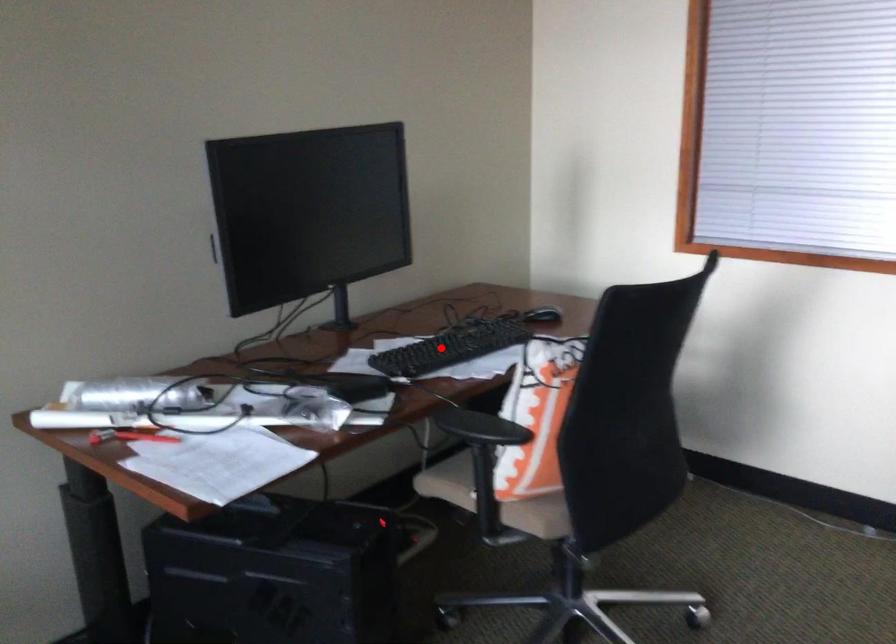
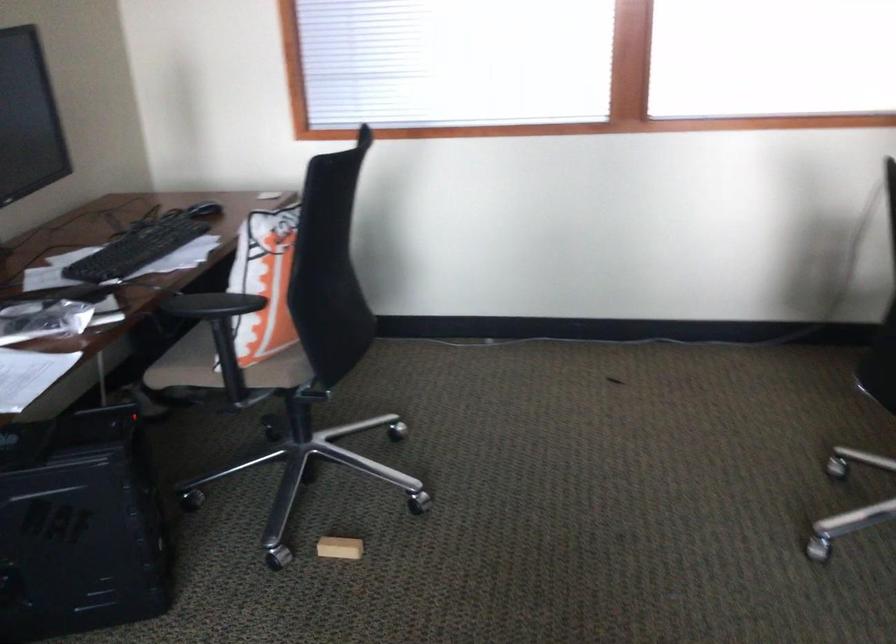
Locate, in the second image, the point that corresponds to the highlighted location in the first image.

(138, 248)